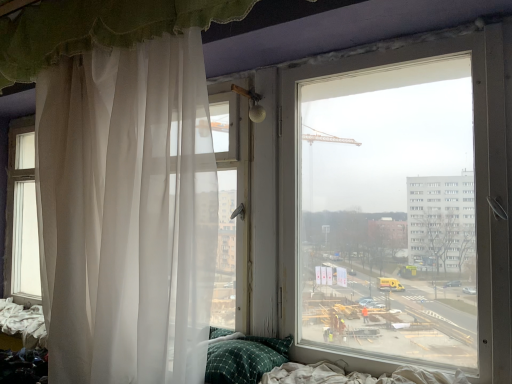
Question: Is white sheer curtain at left, positioned as the 1th curtain in bottom-to-top order, wider or thinner than white sheer curtain at upper left, the second curtain from the bottom?

Choices:
 (A) wide
 (B) thin

Answer: (A)

Question: From a real-world perspective, is white sheer curtain at left, marked as the second curtain in a top-to-bottom arrangement, physically located above or below white sheer curtain at upper left, the first curtain positioned from the top?

Choices:
 (A) above
 (B) below

Answer: (B)

Question: Considering the real-world distances, which object is closest to the green checkered pillow at lower center?

Choices:
 (A) white sheer curtain at upper left, the second curtain from the bottom
 (B) white sheer curtain at left, positioned as the 1th curtain in bottom-to-top order

Answer: (B)

Question: Estimate the real-world distances between objects in this image. Which object is closer to the white sheer curtain at upper left, the second curtain from the bottom?

Choices:
 (A) green checkered pillow at lower center
 (B) white sheer curtain at left, positioned as the 1th curtain in bottom-to-top order

Answer: (B)